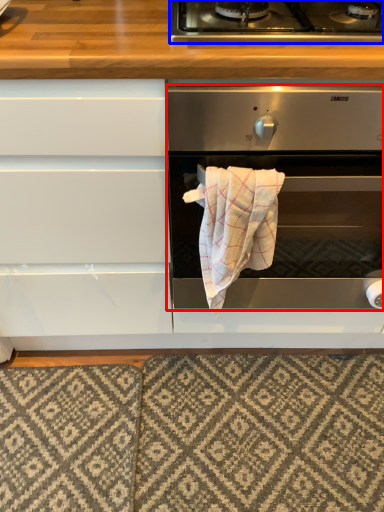
Question: Which object is further to the camera taking this photo, oven (highlighted by a red box) or gas stove (highlighted by a blue box)?

Choices:
 (A) oven
 (B) gas stove

Answer: (B)